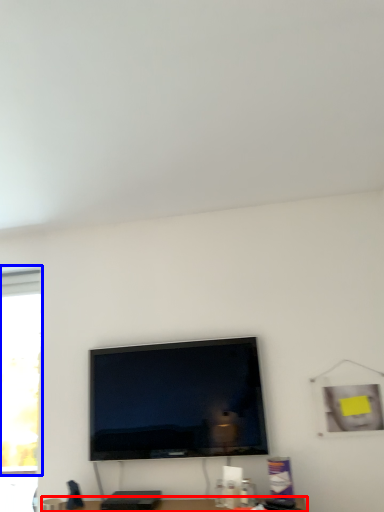
Question: Among these objects, which one is nearest to the camera, furniture (highlighted by a red box) or window (highlighted by a blue box)?

Choices:
 (A) furniture
 (B) window

Answer: (A)